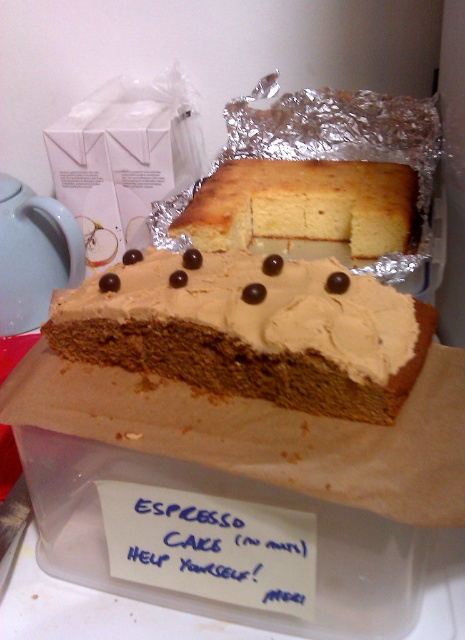
You are a food delivery robot with a height of 32 inches. You need to pick up the yellow sponge cake at center from the table. Can you safely reach it without knocking over the container?

The yellow sponge cake at center and camera are 29.11 inches apart from each other. Since the robot is 32 inches tall, it can safely reach the yellow sponge cake at center as the distance is within its operational range and the height is sufficient to avoid knocking over the container.

You are at a potluck and see two cakes in the center of the table. One is labeled as brown matte cake at center and the other as yellow sponge cake at center. You want to take a slice from the taller cake. Which one should you choose?

The yellow sponge cake at center is taller than the brown matte cake at center, so you should choose the yellow sponge cake at center.

You are standing in front of a container with a cake labeled as ESPRESSO CAKE. There is a point marked at coordinates (252, 330). Based on the description, what object is this point located on?

The point at coordinates (252, 330) is located on the brown matte cake at center.